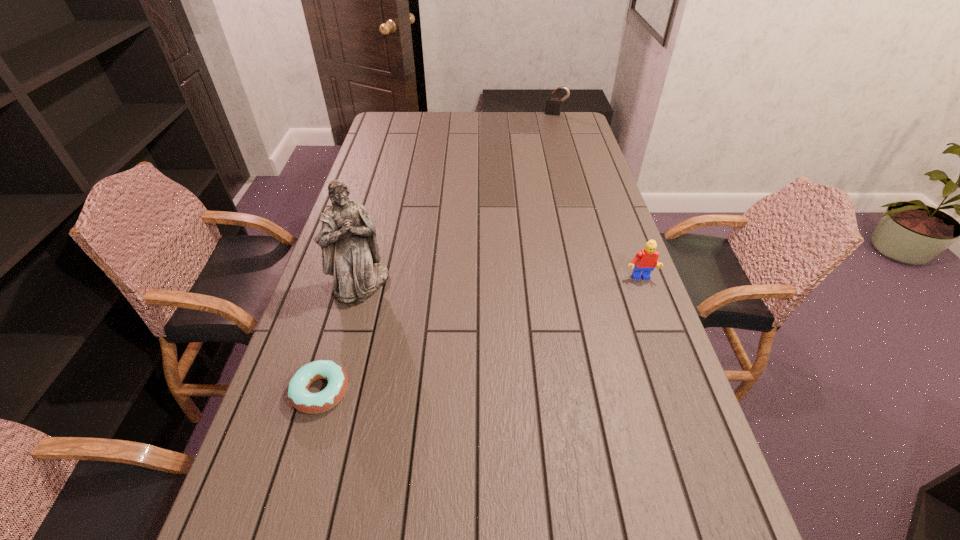
This screenshot has height=540, width=960. I want to click on vacant space located 0.330m with the keyhole on the front of the farthest object, so click(541, 149).

Where is `vacant space situated on the front-facing side of the tallest object`? The width and height of the screenshot is (960, 540). vacant space situated on the front-facing side of the tallest object is located at coordinates [x=435, y=331].

You are a GUI agent. You are given a task and a screenshot of the screen. Output one action in this format:
    pyautogui.click(x=<x>, y=<y>)
    Task: Click on the vacant space located on the front-facing side of the tallest object
    The height and width of the screenshot is (540, 960).
    Given the screenshot: What is the action you would take?
    pyautogui.click(x=432, y=329)

At what (x,y) coordinates should I click in order to perform the action: click on free space located 0.110m on the front-facing side of the tallest object. Please return your answer as a coordinate pair (x, y). This screenshot has height=540, width=960. Looking at the image, I should click on (409, 315).

At what (x,y) coordinates should I click in order to perform the action: click on object situated at the far edge. Please return your answer as a coordinate pair (x, y). Looking at the image, I should click on (553, 105).

At what (x,y) coordinates should I click in order to perform the action: click on doughnut located at the left edge. Please return your answer as a coordinate pair (x, y). Looking at the image, I should click on (299, 396).

Locate an element on the screen. This screenshot has width=960, height=540. figurine positioned at the left edge is located at coordinates (350, 253).

You are a GUI agent. You are given a task and a screenshot of the screen. Output one action in this format:
    pyautogui.click(x=<x>, y=<y>)
    Task: Click on the Lego that is at the right edge
    
    Given the screenshot: What is the action you would take?
    pyautogui.click(x=645, y=261)

Find the location of a particular element. The width and height of the screenshot is (960, 540). padlock that is at the right edge is located at coordinates (553, 105).

Image resolution: width=960 pixels, height=540 pixels. Find the location of `object that is at the far right corner`. object that is at the far right corner is located at coordinates (553, 105).